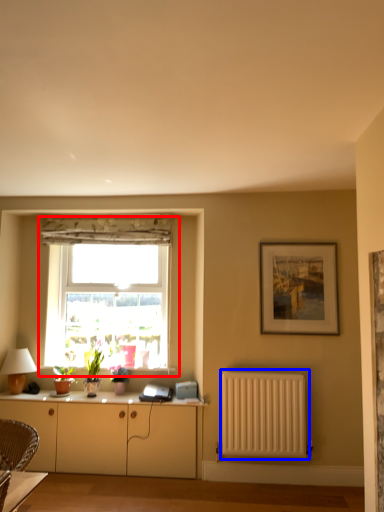
Question: Among these objects, which one is farthest to the camera, window (highlighted by a red box) or radiator (highlighted by a blue box)?

Choices:
 (A) window
 (B) radiator

Answer: (A)